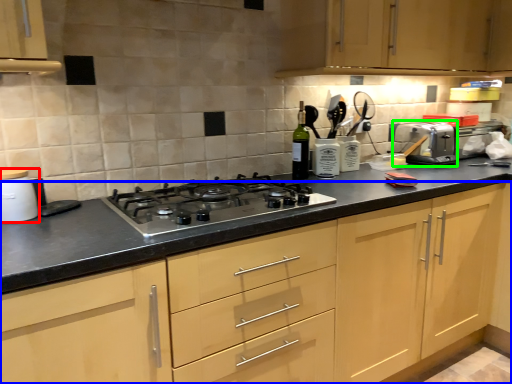
Question: Estimate the real-world distances between objects in this image. Which object is farther from kitchen appliance (highlighted by a red box), cabinetry (highlighted by a blue box) or toaster (highlighted by a green box)?

Choices:
 (A) cabinetry
 (B) toaster

Answer: (B)